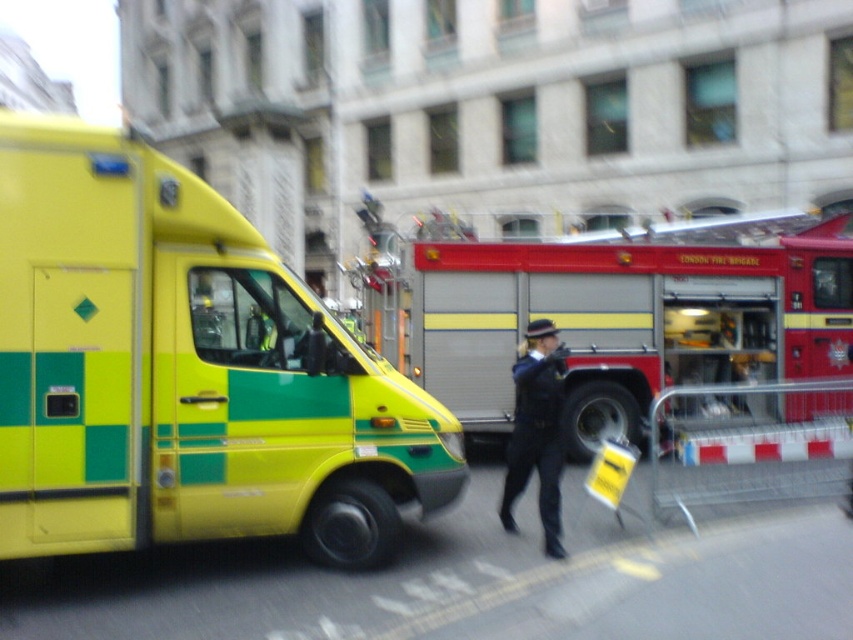
You are a delivery person trying to navigate through the scene. The red metallic fire truck at center and dark blue uniform at center are blocking the path. Can you pass through the space between them?

The red metallic fire truck at center is wider than the dark blue uniform at center, so there is enough space between them for the delivery person to pass through.

You are a pedestrian standing on the sidewalk and see the red metallic fire truck at center and the dark blue uniform at center. Which object is closer to the right edge of the image?

The red metallic fire truck at center is positioned on the right side of dark blue uniform at center, so it is closer to the right edge of the image.